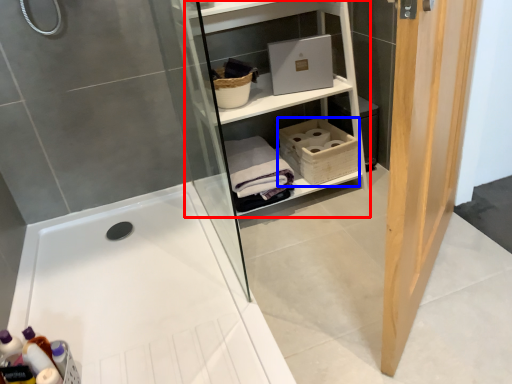
Question: Which object is further to the camera taking this photo, shelf (highlighted by a red box) or basket (highlighted by a blue box)?

Choices:
 (A) shelf
 (B) basket

Answer: (B)